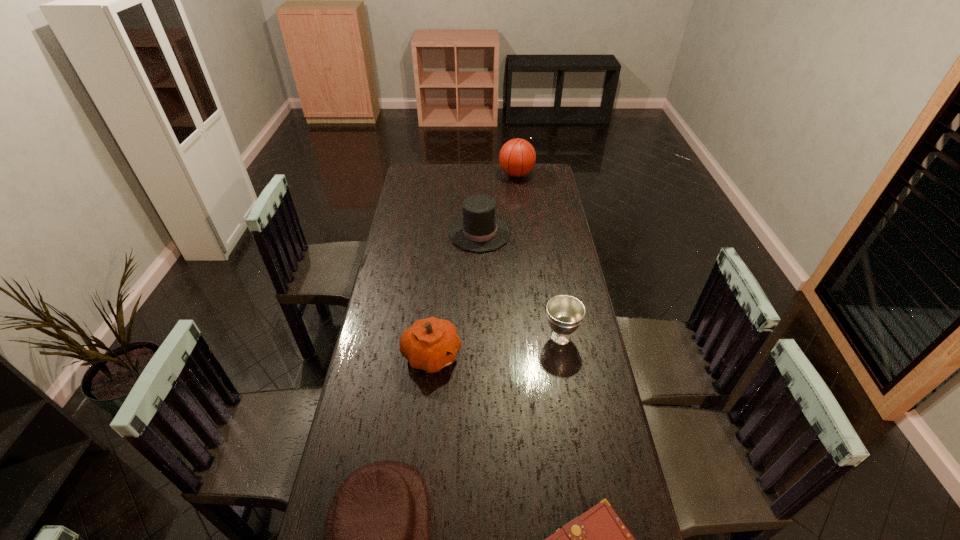
Locate an element on the screen. This screenshot has width=960, height=540. object at the far edge is located at coordinates (517, 157).

Locate an element on the screen. object located at the left edge is located at coordinates (430, 344).

Where is `basketball positioned at the right edge`? basketball positioned at the right edge is located at coordinates (517, 157).

Locate an element on the screen. The width and height of the screenshot is (960, 540). chalice at the right edge is located at coordinates (565, 313).

This screenshot has height=540, width=960. I want to click on object present at the far right corner, so click(x=517, y=157).

Image resolution: width=960 pixels, height=540 pixels. In the image, there is a desktop. In order to click on free space at the far edge in this screenshot , I will do `click(489, 183)`.

Identify the location of free region at the left edge of the desktop. (413, 240).

You are a GUI agent. You are given a task and a screenshot of the screen. Output one action in this format:
    pyautogui.click(x=<x>, y=<y>)
    Task: Click on the free space at the right edge of the desktop
    
    Given the screenshot: What is the action you would take?
    pyautogui.click(x=538, y=258)

In order to click on vacant area that lies between the second farthest object and the tallest object in this screenshot , I will do `click(498, 204)`.

Find the location of `vacant space in between the farthest object and the pumpkin`. vacant space in between the farthest object and the pumpkin is located at coordinates (474, 265).